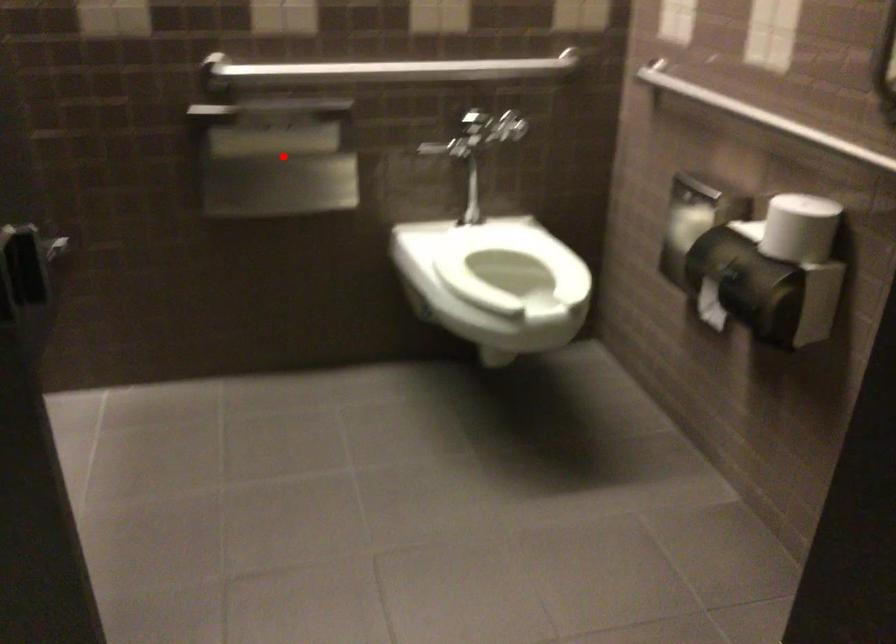
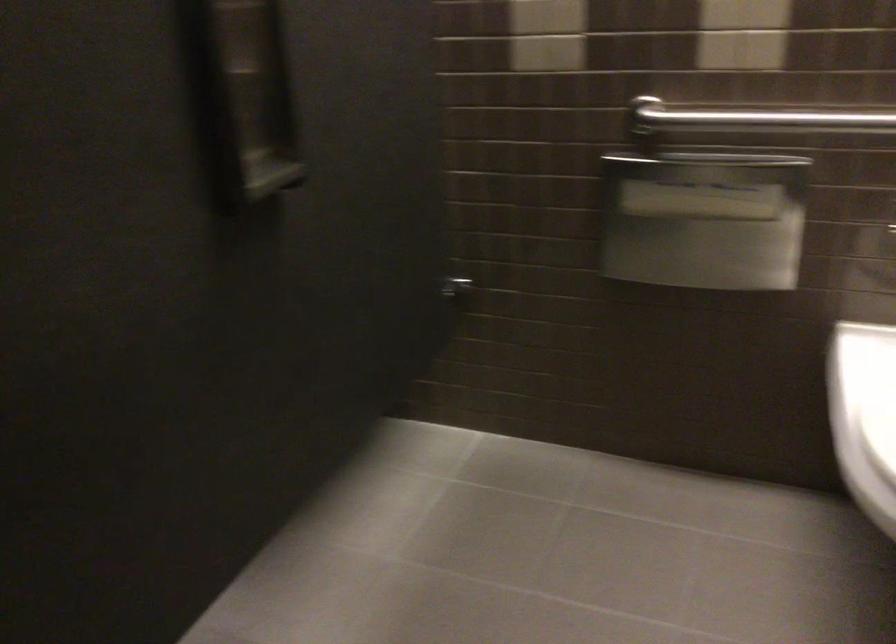
Where in the second image is the point corresponding to the highlighted location from the first image?

(703, 220)